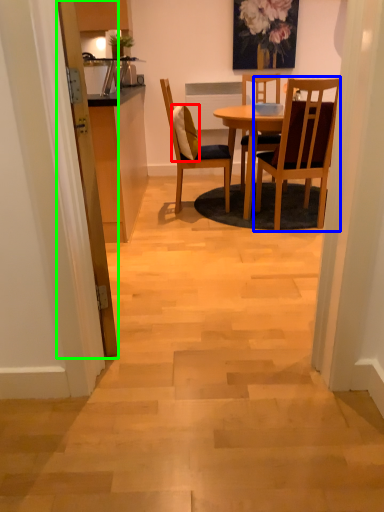
Question: Which is farther away from pillow (highlighted by a red box)? chair (highlighted by a blue box) or door (highlighted by a green box)?

Choices:
 (A) chair
 (B) door

Answer: (B)